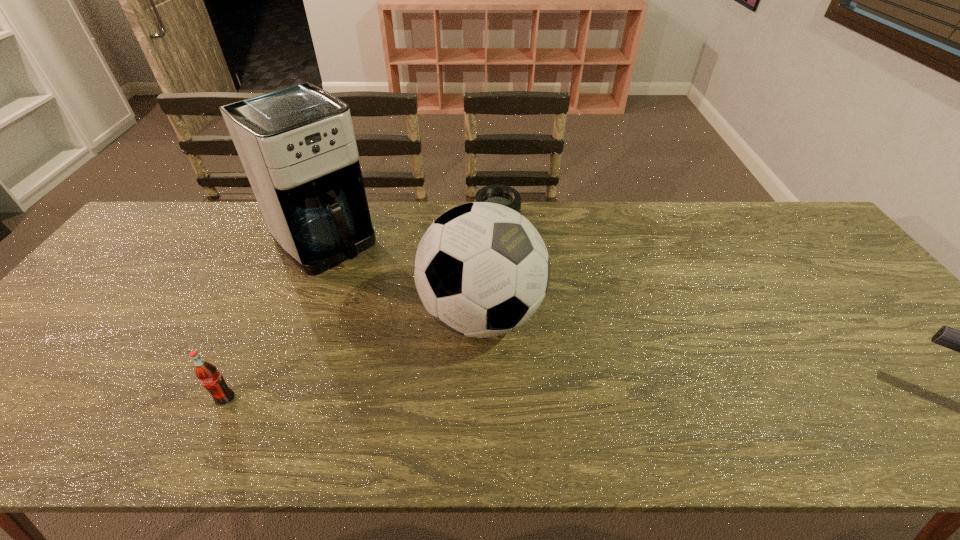
You are a GUI agent. You are given a task and a screenshot of the screen. Output one action in this format:
    pyautogui.click(x=<x>, y=<y>)
    Task: Click on the vacant space at the far left corner of the desktop
    The image size is (960, 540).
    Given the screenshot: What is the action you would take?
    pyautogui.click(x=180, y=238)

The height and width of the screenshot is (540, 960). I want to click on empty location between the shortest object and the soda bottle, so click(x=361, y=310).

You are a GUI agent. You are given a task and a screenshot of the screen. Output one action in this format:
    pyautogui.click(x=<x>, y=<y>)
    Task: Click on the vacant area between the soccer ball and the soda bottle
    
    Given the screenshot: What is the action you would take?
    pyautogui.click(x=353, y=356)

Find the location of `blank region between the tallest object and the soccer ball`. blank region between the tallest object and the soccer ball is located at coordinates (403, 278).

Find the location of a particular element. This screenshot has height=540, width=960. vacant area that lies between the soda bottle and the coffee maker is located at coordinates (276, 319).

Where is `free space between the soccer ball and the tallest object`? Image resolution: width=960 pixels, height=540 pixels. free space between the soccer ball and the tallest object is located at coordinates (403, 278).

The height and width of the screenshot is (540, 960). Identify the location of free space between the fourth shortest object and the soda bottle. (353, 356).

Identify which object is the second nearest to the rightmost object. Please provide its 2D coordinates. Your answer should be formatted as a tuple, i.e. [(x, y)], where the tuple contains the x and y coordinates of a point satisfying the conditions above.

[(504, 195)]

Select which object is the third closest to the gun. Please provide its 2D coordinates. Your answer should be formatted as a tuple, i.e. [(x, y)], where the tuple contains the x and y coordinates of a point satisfying the conditions above.

[(297, 145)]